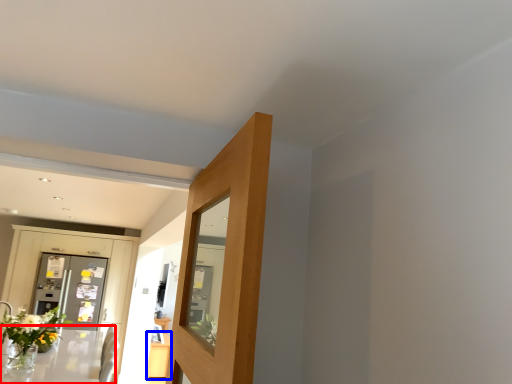
Question: Among these objects, which one is nearest to the camera, table (highlighted by a red box) or table (highlighted by a blue box)?

Choices:
 (A) table
 (B) table

Answer: (A)